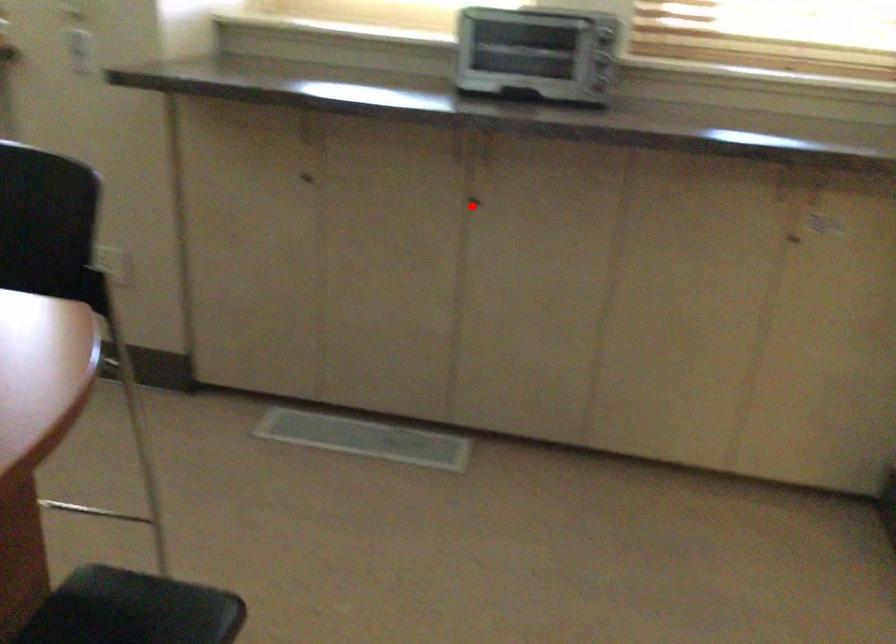
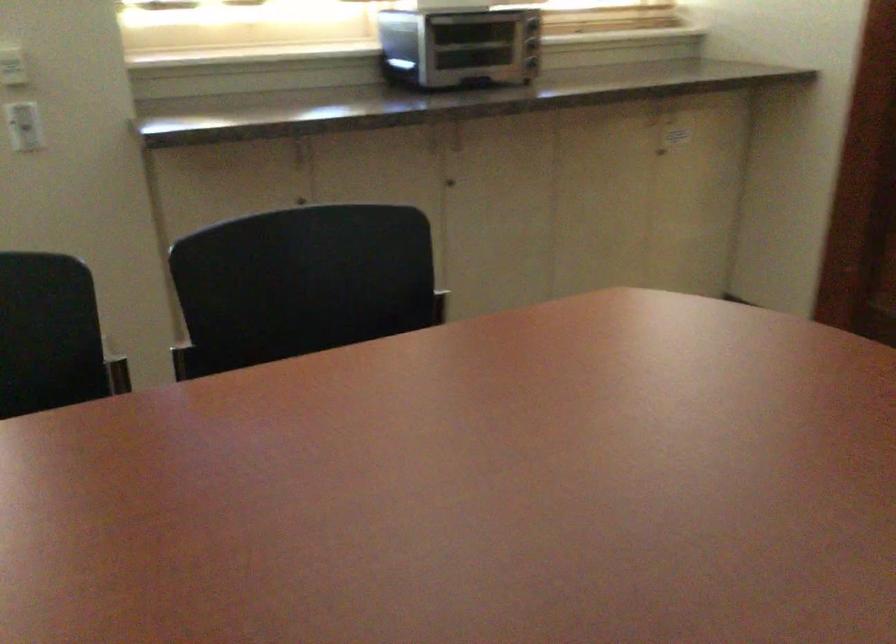
Find the pixel in the second image that matches the highlighted location in the first image.

(450, 183)